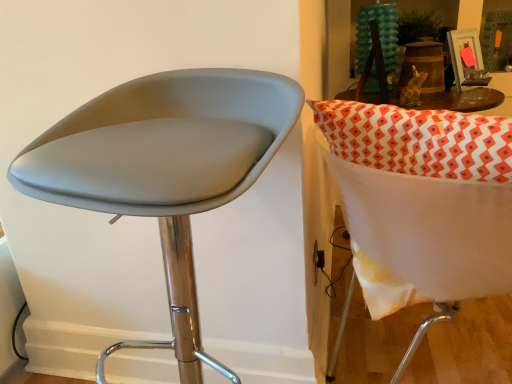
Question: From the image's perspective, is white fabric chair at right, which appears as the first chair when viewed from the right, below matte gray stool at left, placed as the second chair when sorted from right to left?

Choices:
 (A) yes
 (B) no

Answer: (B)

Question: From a real-world perspective, does white fabric chair at right, placed as the 2th chair when sorted from left to right, sit lower than matte gray stool at left, which is the 1th chair in left-to-right order?

Choices:
 (A) yes
 (B) no

Answer: (A)

Question: Does white fabric chair at right, placed as the 2th chair when sorted from left to right, have a smaller size compared to matte gray stool at left, which is the 1th chair in left-to-right order?

Choices:
 (A) no
 (B) yes

Answer: (A)

Question: Does white fabric chair at right, which appears as the first chair when viewed from the right, appear on the left side of matte gray stool at left, which is the 1th chair in left-to-right order?

Choices:
 (A) no
 (B) yes

Answer: (A)

Question: Considering the relative sizes of white fabric chair at right, placed as the 2th chair when sorted from left to right, and matte gray stool at left, which is the 1th chair in left-to-right order, in the image provided, is white fabric chair at right, placed as the 2th chair when sorted from left to right, wider than matte gray stool at left, which is the 1th chair in left-to-right order,?

Choices:
 (A) yes
 (B) no

Answer: (A)

Question: Does white fabric chair at right, which appears as the first chair when viewed from the right, touch matte gray stool at left, placed as the second chair when sorted from right to left?

Choices:
 (A) yes
 (B) no

Answer: (B)

Question: Is matte gray stool at left, placed as the second chair when sorted from right to left, wider than white fabric chair at right, placed as the 2th chair when sorted from left to right?

Choices:
 (A) no
 (B) yes

Answer: (A)

Question: Does matte gray stool at left, placed as the second chair when sorted from right to left, turn towards white fabric chair at right, which appears as the first chair when viewed from the right?

Choices:
 (A) yes
 (B) no

Answer: (B)

Question: From a real-world perspective, is matte gray stool at left, which is the 1th chair in left-to-right order, on white fabric chair at right, which appears as the first chair when viewed from the right?

Choices:
 (A) no
 (B) yes

Answer: (B)

Question: Is matte gray stool at left, which is the 1th chair in left-to-right order, looking in the opposite direction of white fabric chair at right, which appears as the first chair when viewed from the right?

Choices:
 (A) yes
 (B) no

Answer: (A)

Question: From the image's perspective, is matte gray stool at left, placed as the second chair when sorted from right to left, located above white fabric chair at right, which appears as the first chair when viewed from the right?

Choices:
 (A) yes
 (B) no

Answer: (B)

Question: Is matte gray stool at left, placed as the second chair when sorted from right to left, at the left side of white fabric chair at right, placed as the 2th chair when sorted from left to right?

Choices:
 (A) yes
 (B) no

Answer: (A)

Question: Based on their sizes in the image, would you say matte gray stool at left, which is the 1th chair in left-to-right order, is bigger or smaller than white fabric chair at right, placed as the 2th chair when sorted from left to right?

Choices:
 (A) small
 (B) big

Answer: (A)